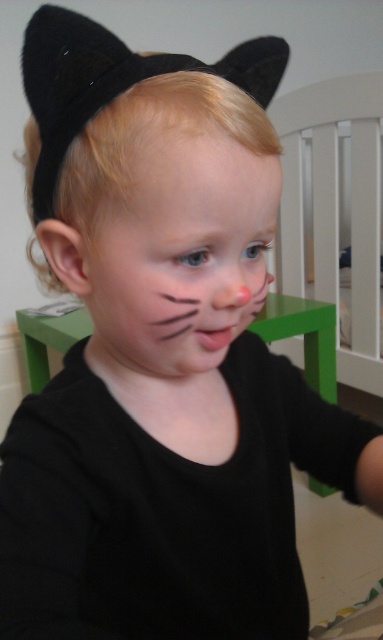
From the picture: Based on the scene description, which object at the center has a larger size between the matte black face at center and the smooth skin at center?

The matte black face at center is larger in size than the smooth skin at center according to the description.

Based on the scene description, can you determine the spatial relationship between the matte black face at center and the smooth skin at center?

The matte black face at center is positioned to the left of the smooth skin at center.